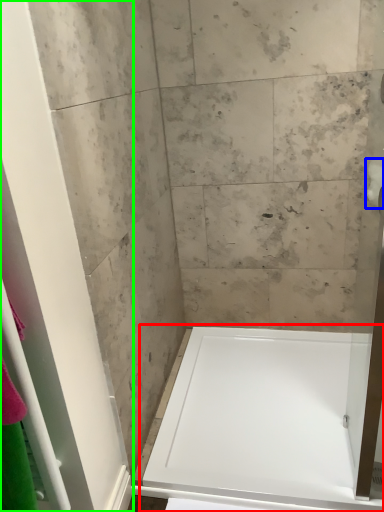
Question: Estimate the real-world distances between objects in this image. Which object is closer to bathtub (highlighted by a red box), toilet paper (highlighted by a blue box) or screen door (highlighted by a green box)?

Choices:
 (A) toilet paper
 (B) screen door

Answer: (B)